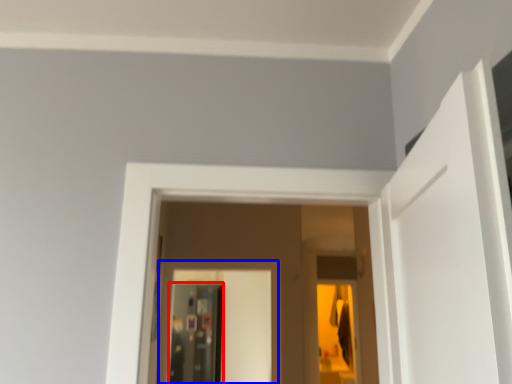
Question: Which object is further to the camera taking this photo, screen door (highlighted by a red box) or screen door (highlighted by a blue box)?

Choices:
 (A) screen door
 (B) screen door

Answer: (A)